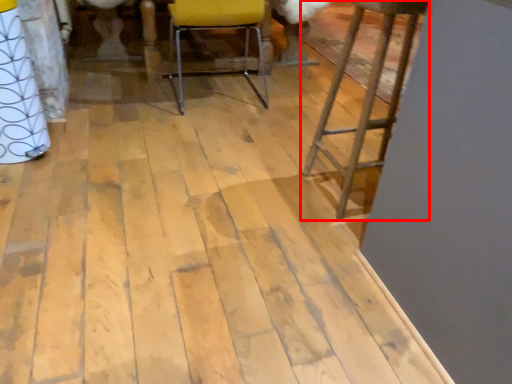
Question: From the image's perspective, where is furniture (annotated by the red box) located relative to chair?

Choices:
 (A) above
 (B) below

Answer: (B)